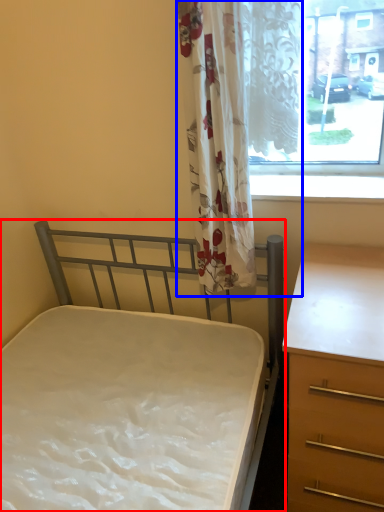
Question: Among these objects, which one is nearest to the camera, bed (highlighted by a red box) or curtain (highlighted by a blue box)?

Choices:
 (A) bed
 (B) curtain

Answer: (A)